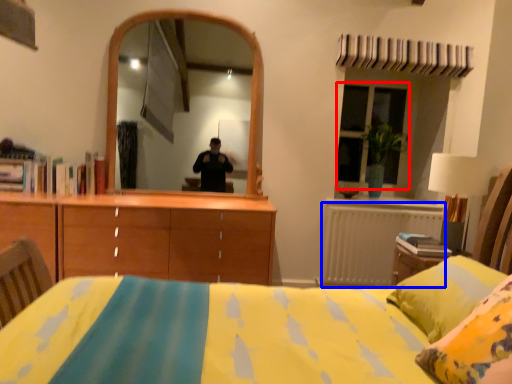
Question: Which object is further to the camera taking this photo, window (highlighted by a red box) or radiator (highlighted by a blue box)?

Choices:
 (A) window
 (B) radiator

Answer: (A)